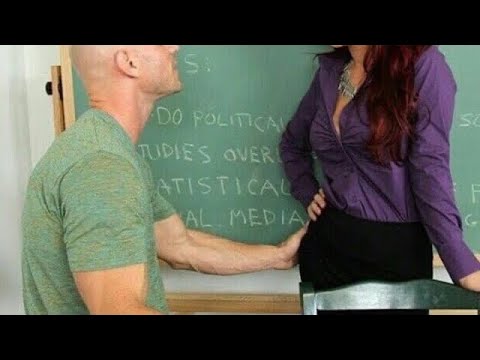
Locate an element on the screen. The width and height of the screenshot is (480, 360). green chalkboard is located at coordinates pos(257,68).